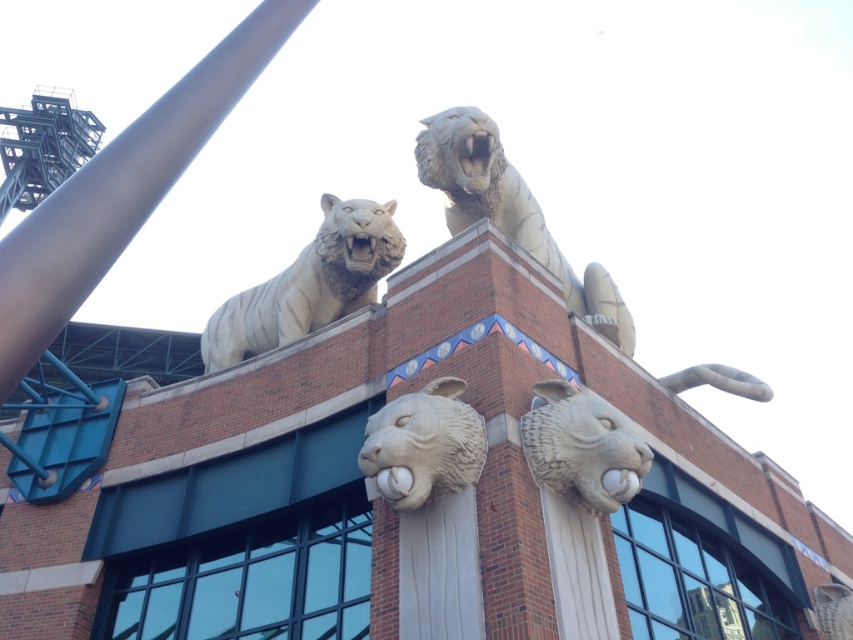
You are an architect reviewing the design of the brick building. You notice the white stone tiger at upper center and the white stone lion head at center. Which of these two decorative elements is placed higher up on the building?

The white stone tiger at upper center is positioned over the white stone lion head at center, so it is placed higher up on the building.

You are standing at the base of the brick building and want to take a photo of the white stone lion head at center. If your camera is 1.5 meters tall, will you be able to see the entire lion head in your viewfinder without moving closer or further away?

The white stone lion head at center and camera are 33.41 meters apart from each other. Since the camera is 1.5 meters tall, the distance is sufficient to capture the entire lion head in the viewfinder without needing to adjust your position.